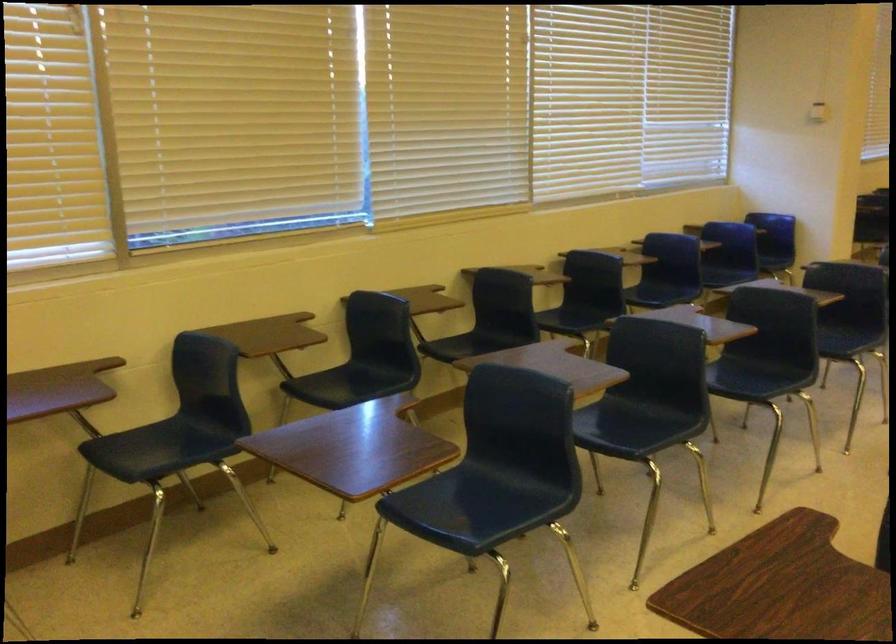
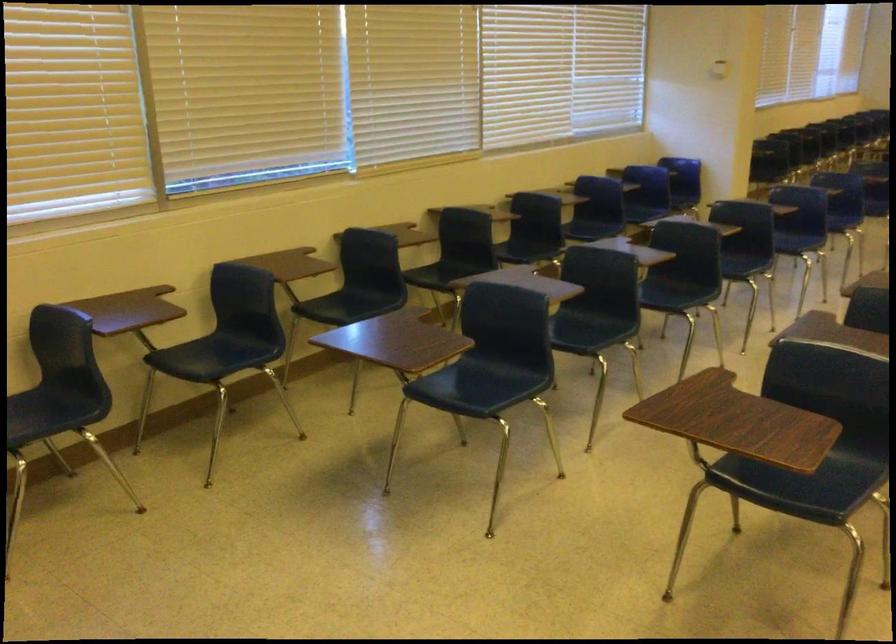
Locate, in the second image, the point that corresponds to (364,384) in the first image.

(359, 303)